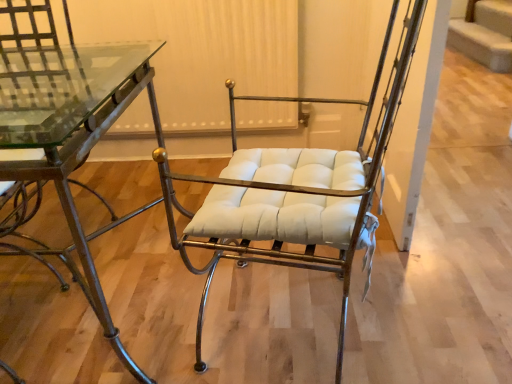
Question: Which is correct: metallic glass table at left is inside white leather chair at center, or outside of it?

Choices:
 (A) outside
 (B) inside

Answer: (A)

Question: In the image, is metallic glass table at left positioned in front of or behind white leather chair at center?

Choices:
 (A) behind
 (B) front

Answer: (A)

Question: In terms of height, does metallic glass table at left look taller or shorter compared to white leather chair at center?

Choices:
 (A) short
 (B) tall

Answer: (A)

Question: Is point (166, 218) closer or farther from the camera than point (83, 160)?

Choices:
 (A) farther
 (B) closer

Answer: (A)

Question: From the image's perspective, relative to metallic glass table at left, is white leather chair at center above or below?

Choices:
 (A) below
 (B) above

Answer: (B)

Question: Would you say white leather chair at center is to the left or to the right of metallic glass table at left in the picture?

Choices:
 (A) right
 (B) left

Answer: (A)

Question: Is white leather chair at center taller or shorter than metallic glass table at left?

Choices:
 (A) short
 (B) tall

Answer: (B)